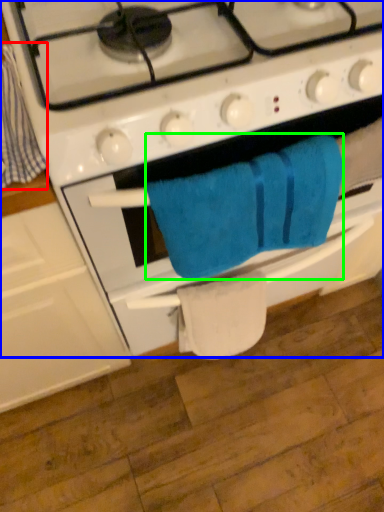
Question: Considering the real-world distances, which object is farthest from beach towel (highlighted by a red box)? gas stove (highlighted by a blue box) or towel/napkin (highlighted by a green box)?

Choices:
 (A) gas stove
 (B) towel/napkin

Answer: (B)